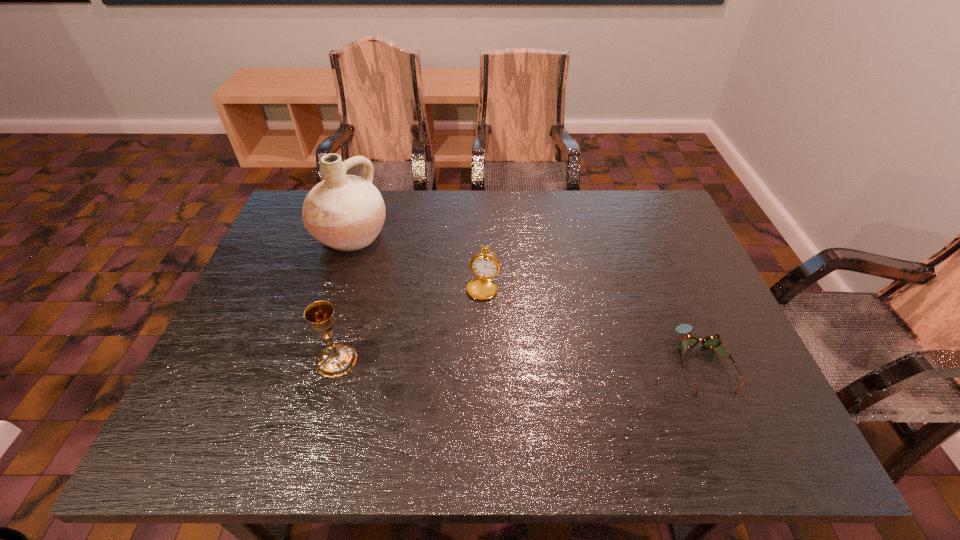
Locate an element on the screen. blank area located 0.300m on the face of the third tallest object is located at coordinates (461, 408).

In order to click on vacant space situated to pour from the handle of the farthest object in this screenshot , I will do `click(446, 308)`.

Locate an element on the screen. The width and height of the screenshot is (960, 540). free region located to pour from the handle of the farthest object is located at coordinates (398, 272).

Locate an element on the screen. vacant space located to pour from the handle of the farthest object is located at coordinates pyautogui.click(x=444, y=306).

What are the coordinates of `object that is at the far edge` in the screenshot? It's located at (345, 212).

Identify the location of chalice that is at the near edge. (337, 360).

The height and width of the screenshot is (540, 960). I want to click on spectacles present at the near edge, so point(712,341).

This screenshot has height=540, width=960. Find the location of `object positioned at the left edge`. object positioned at the left edge is located at coordinates (345, 212).

At what (x,y) coordinates should I click in order to perform the action: click on object present at the right edge. Please return your answer as a coordinate pair (x, y). Looking at the image, I should click on pos(712,341).

I want to click on object that is at the far left corner, so click(345, 212).